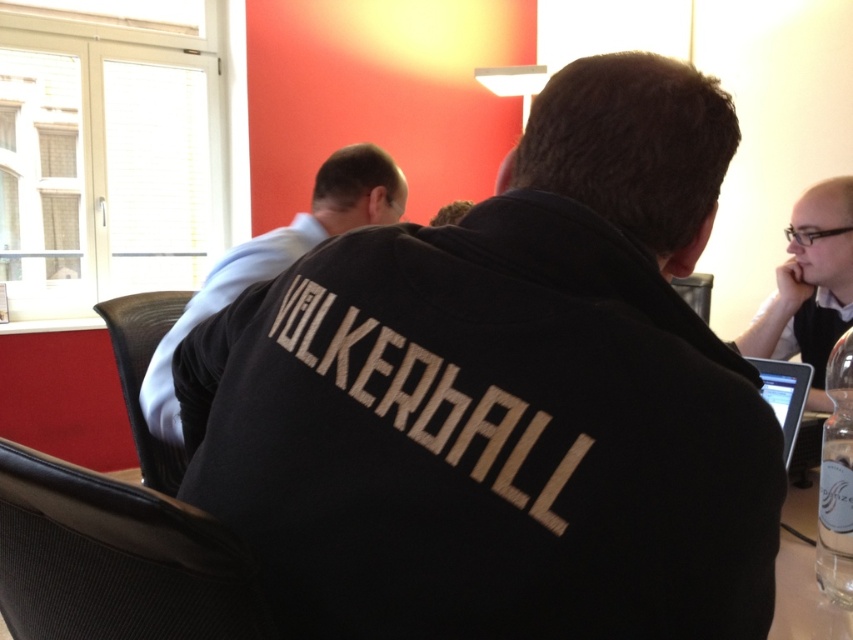
Can you confirm if black cotton hoodie at center is positioned to the left of matte black tablet at lower right?

Correct, you'll find black cotton hoodie at center to the left of matte black tablet at lower right.

Does point (380, 445) come closer to viewer compared to point (799, 403)?

That is True.

Between point (579, 164) and point (778, 378), which one is positioned in front?

Positioned in front is point (579, 164).

You are a GUI agent. You are given a task and a screenshot of the screen. Output one action in this format:
    pyautogui.click(x=<x>, y=<y>)
    Task: Click on the black cotton hoodie at center
    This screenshot has height=640, width=853.
    Given the screenshot: What is the action you would take?
    (x=505, y=400)

This screenshot has height=640, width=853. What are the coordinates of `black cotton hoodie at center` in the screenshot? It's located at (505, 400).

Is black cotton hoodie at center wider than white shirt at upper left?

No.

Locate an element on the screen. black cotton hoodie at center is located at coordinates (505, 400).

Locate an element on the screen. The image size is (853, 640). black cotton hoodie at center is located at coordinates (505, 400).

Which is more to the right, white shirt at upper left or black glossy laptop at right?

black glossy laptop at right

Is point (218, 298) farther from viewer compared to point (743, 342)?

No.

Where is `white shirt at upper left`? Image resolution: width=853 pixels, height=640 pixels. white shirt at upper left is located at coordinates (270, 273).

Locate an element on the screen. This screenshot has width=853, height=640. white shirt at upper left is located at coordinates (270, 273).